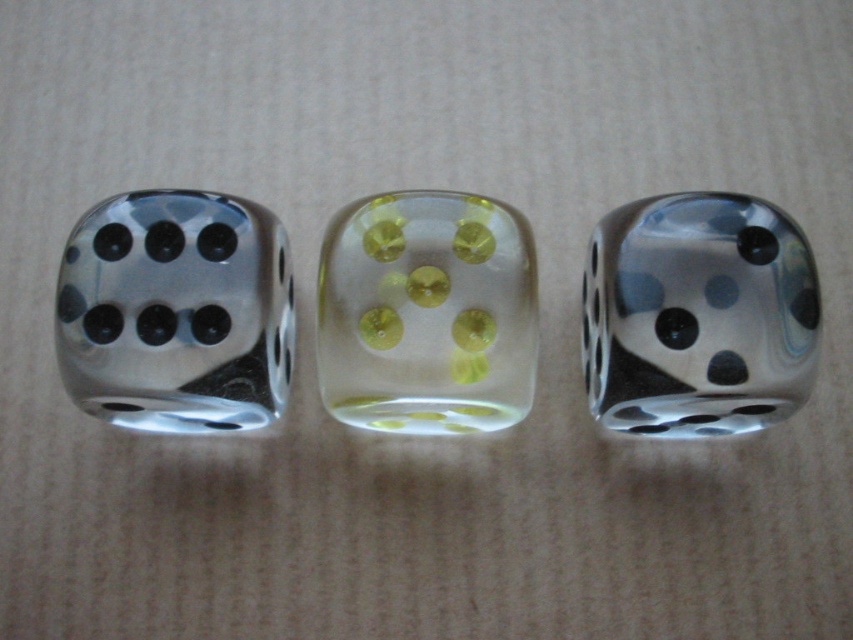
Question: Among these points, which one is nearest to the camera?

Choices:
 (A) (152, 294)
 (B) (427, 307)
 (C) (587, 321)

Answer: (A)

Question: Can you confirm if translucent glass dice at left is thinner than translucent yellow-green dice at center?

Choices:
 (A) no
 (B) yes

Answer: (A)

Question: Which object appears closest to the camera in this image?

Choices:
 (A) translucent yellow-green dice at center
 (B) translucent glass dice at left
 (C) transparent glass die at center

Answer: (C)

Question: Can you confirm if translucent glass dice at left is wider than transparent glass die at center?

Choices:
 (A) yes
 (B) no

Answer: (A)

Question: Does translucent glass dice at left lie in front of transparent glass die at center?

Choices:
 (A) yes
 (B) no

Answer: (B)

Question: Considering the real-world distances, which object is farthest from the translucent yellow-green dice at center?

Choices:
 (A) transparent glass die at center
 (B) translucent glass dice at left

Answer: (A)